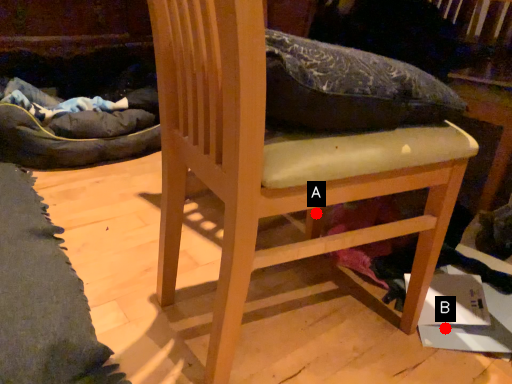
Question: Two points are circled on the image, labeled by A and B beside each circle. Which point is farther to the camera?

Choices:
 (A) A is further
 (B) B is further

Answer: (A)